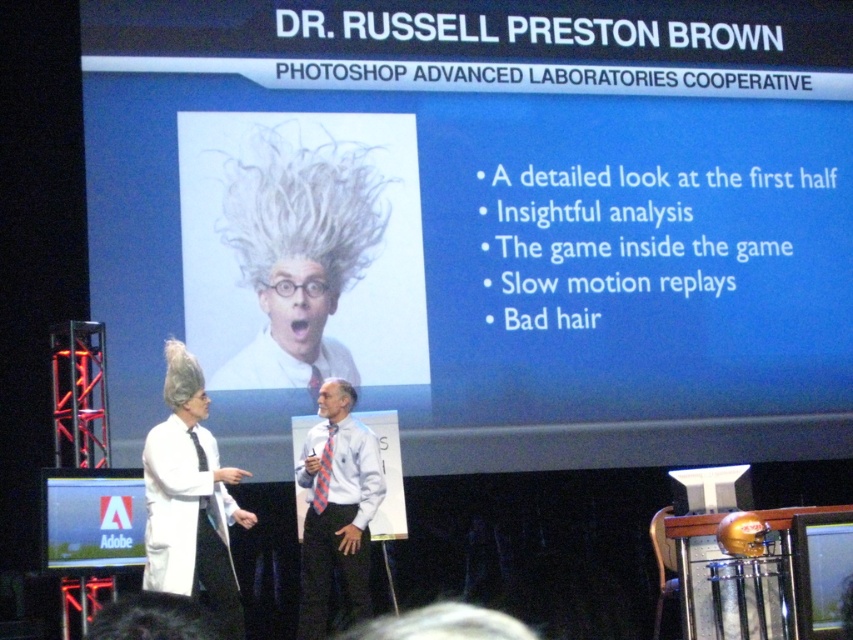
Is point (224, 401) closer to viewer compared to point (128, 536)?

No, it is not.

Which of these two, blue matte projection screen at upper center or matte black screen at lower left, stands shorter?

matte black screen at lower left is shorter.

You are a GUI agent. You are given a task and a screenshot of the screen. Output one action in this format:
    pyautogui.click(x=<x>, y=<y>)
    Task: Click on the blue matte projection screen at upper center
    The width and height of the screenshot is (853, 640).
    Given the screenshot: What is the action you would take?
    pyautogui.click(x=480, y=221)

Consider the image. Who is positioned more to the right, blue matte projection screen at upper center or white shirt at center?

blue matte projection screen at upper center

Does point (809, 161) come in front of point (351, 452)?

No, it is not.

Measure the distance between blue matte projection screen at upper center and camera.

18.48 meters

Find the location of a particular element. The width and height of the screenshot is (853, 640). blue matte projection screen at upper center is located at coordinates (480, 221).

How distant is white shirt at center from matte black screen at lower left?

They are 3.90 meters apart.

Which of these two, white shirt at center or matte black screen at lower left, stands taller?

With more height is white shirt at center.

Measure the distance between point (366, 541) and camera.

Point (366, 541) and camera are 58.81 feet apart from each other.

Image resolution: width=853 pixels, height=640 pixels. What are the coordinates of `white shirt at center` in the screenshot? It's located at (335, 508).